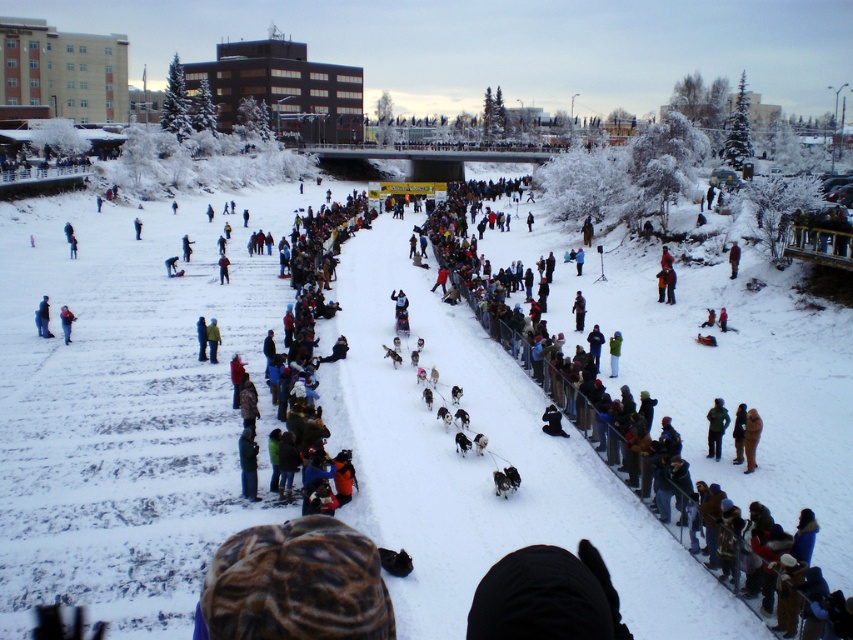
Does blue fabric jacket at lower left lie behind blue woolen hat at center?

Yes.

Image resolution: width=853 pixels, height=640 pixels. Describe the element at coordinates (42, 317) in the screenshot. I see `blue fabric jacket at lower left` at that location.

Which is in front, point (39, 324) or point (206, 356)?

Positioned in front is point (206, 356).

Where is `blue fabric jacket at lower left`? blue fabric jacket at lower left is located at coordinates (42, 317).

Who is taller, white snow at center or blue fabric jacket at center?

white snow at center is taller.

Does point (428, 580) lie behind point (244, 474)?

That is False.

Is point (146, 440) farther from camera compared to point (247, 474)?

Yes, point (146, 440) is behind point (247, 474).

Identify the location of white snow at center. (129, 401).

Between white snow at center and brown fuzzy coat at lower right, which one appears on the right side from the viewer's perspective?

brown fuzzy coat at lower right

Between point (351, 440) and point (755, 435), which one is positioned behind?

Point (351, 440)

Between point (148, 257) and point (756, 416), which one is positioned behind?

Positioned behind is point (148, 257).

Where is `white snow at center`? This screenshot has height=640, width=853. white snow at center is located at coordinates (129, 401).